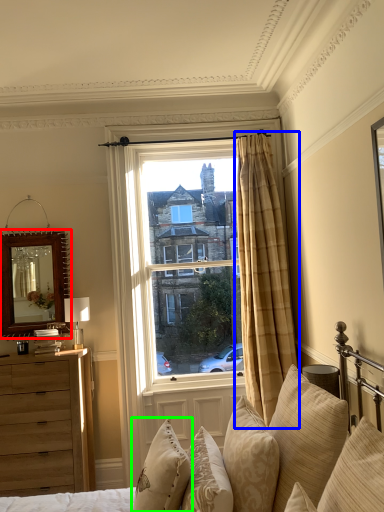
Question: Based on their relative distances, which object is nearer to mirror (highlighted by a red box)? Choose from curtain (highlighted by a blue box) and pillow (highlighted by a green box).

Choices:
 (A) curtain
 (B) pillow

Answer: (A)